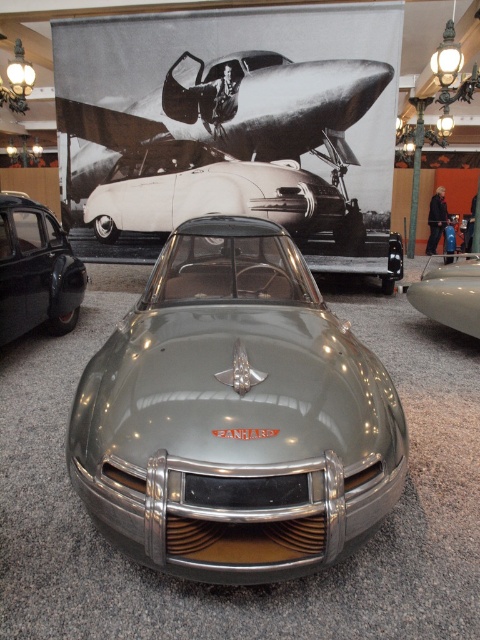
Can you confirm if satin silver concept car at center is bigger than shiny silver airplane at upper center?

Incorrect, satin silver concept car at center is not larger than shiny silver airplane at upper center.

Is point (313, 284) positioned after point (254, 147)?

That is False.

Locate an element on the screen. This screenshot has height=640, width=480. satin silver concept car at center is located at coordinates (235, 416).

Find the location of a particular element. Image resolution: width=480 pixels, height=640 pixels. satin silver concept car at center is located at coordinates (235, 416).

Is metallic silver sports car at center further to the viewer compared to satin silver car at center?

That is True.

Does metallic silver sports car at center appear on the left side of satin silver car at center?

Indeed, metallic silver sports car at center is positioned on the left side of satin silver car at center.

Between point (245, 186) and point (472, 300), which one is positioned behind?

Positioned behind is point (245, 186).

Locate an element on the screen. This screenshot has width=480, height=640. metallic silver sports car at center is located at coordinates (218, 193).

Who is positioned more to the left, satin silver concept car at center or matte black car at lower left?

matte black car at lower left is more to the left.

Does satin silver concept car at center lie behind matte black car at lower left?

No, satin silver concept car at center is closer to the viewer.

The width and height of the screenshot is (480, 640). Describe the element at coordinates (235, 416) in the screenshot. I see `satin silver concept car at center` at that location.

Where is `satin silver concept car at center`? The image size is (480, 640). satin silver concept car at center is located at coordinates (235, 416).